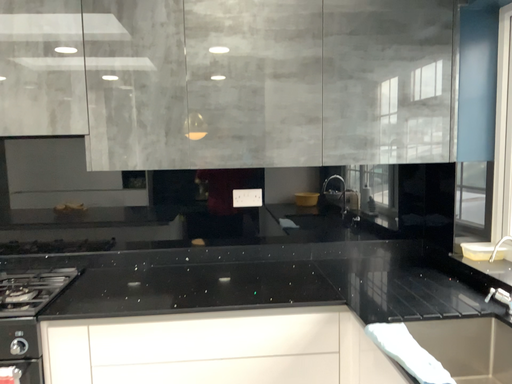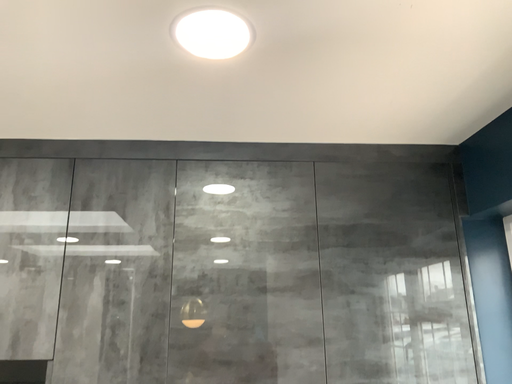
Question: Which way did the camera rotate in the video?

Choices:
 (A) rotated downward
 (B) rotated upward

Answer: (B)